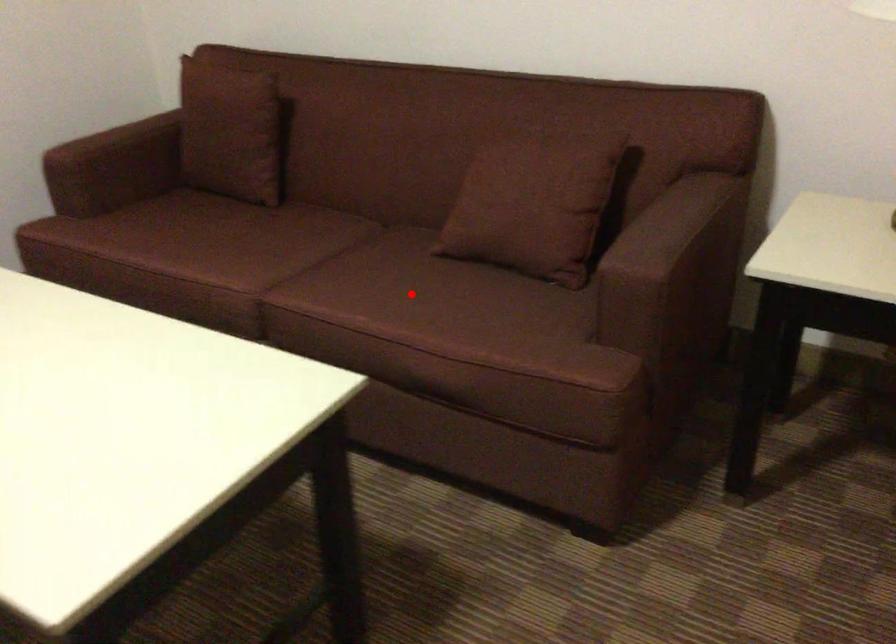
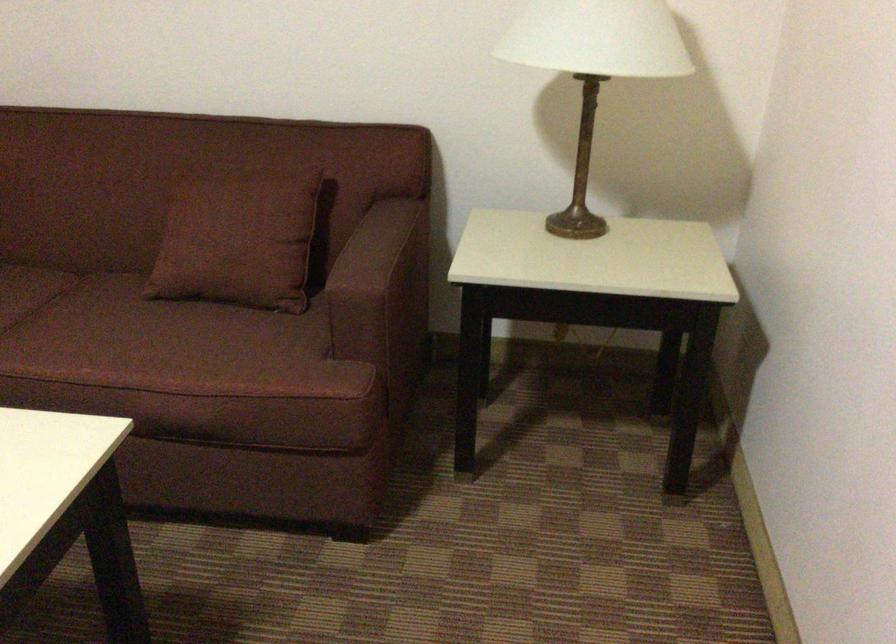
Find the pixel in the second image that matches the highlighted location in the first image.

(135, 339)